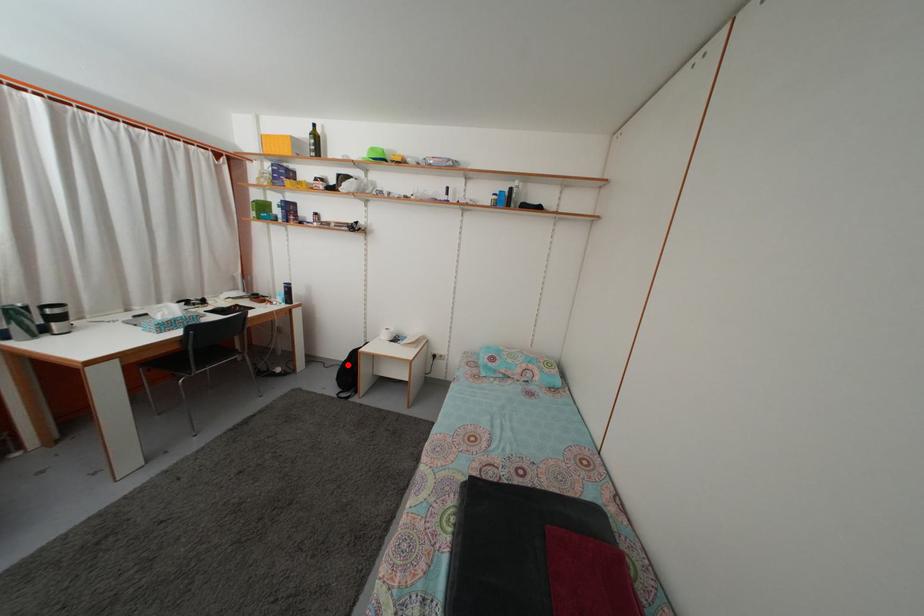
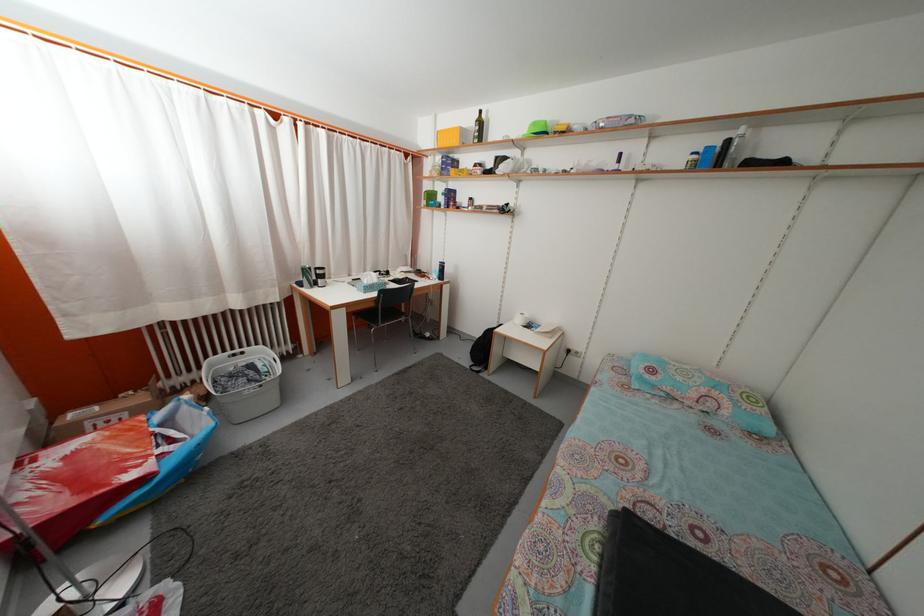
In the second image, find the point that corresponds to the highlighted location in the first image.

(482, 342)